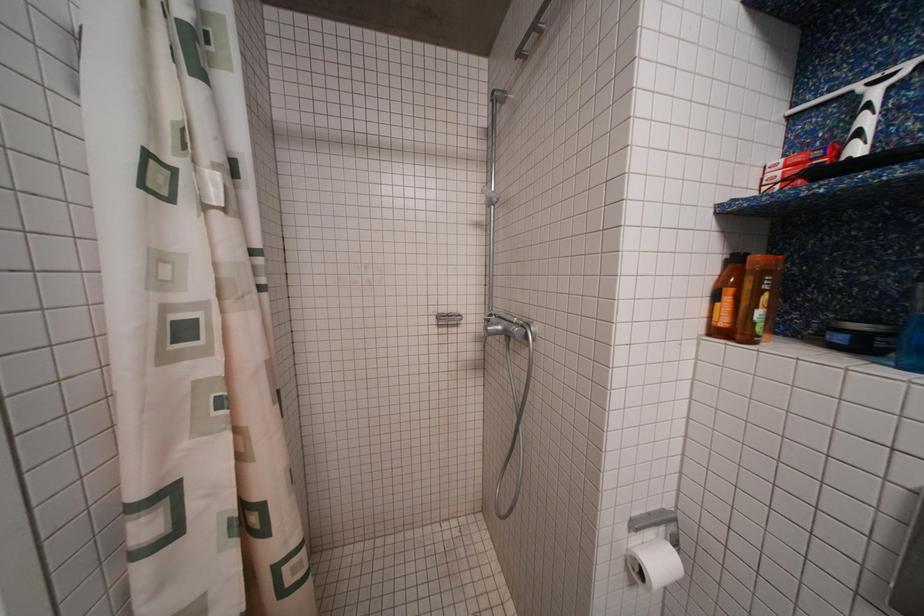
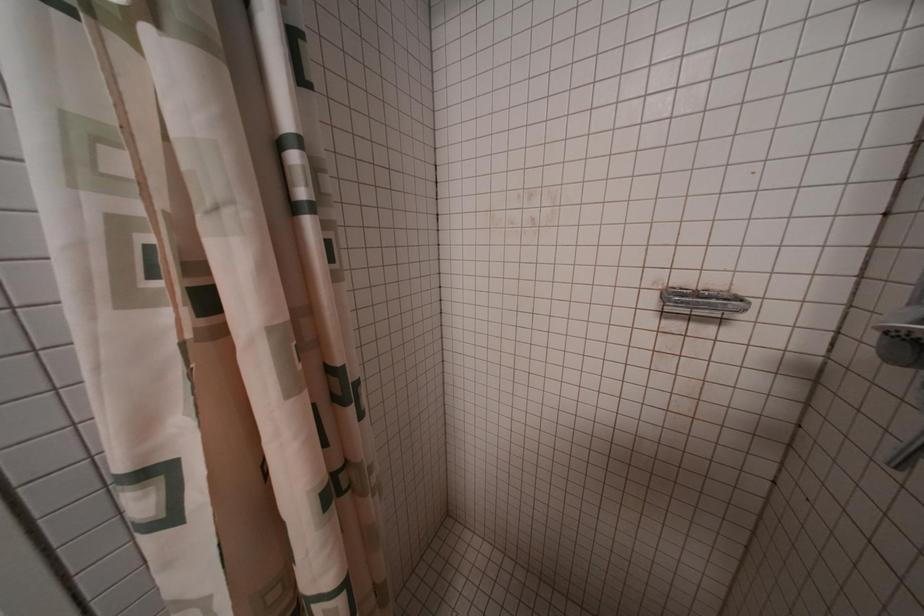
Question: The images are taken continuously from a first-person perspective. In which direction is your viewpoint rotating?

Choices:
 (A) Left
 (B) Right
 (C) Up
 (D) Down

Answer: (A)